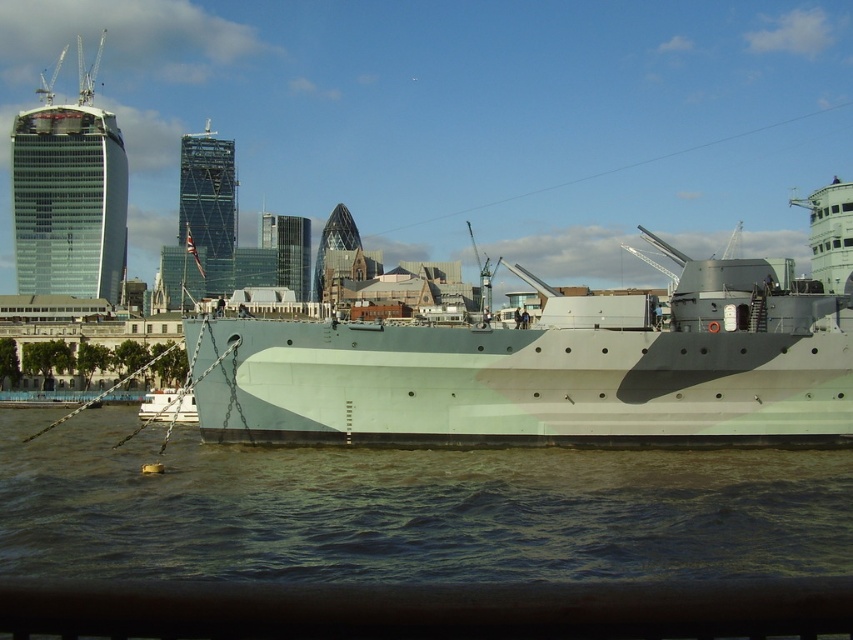
Question: Which point is closer to the camera?

Choices:
 (A) (178, 413)
 (B) (405, 552)

Answer: (B)

Question: Is light gray metallic ship at center below white matte boat at lower left?

Choices:
 (A) no
 (B) yes

Answer: (A)

Question: Can you confirm if greenish water at lower center is positioned to the right of light gray metallic ship at center?

Choices:
 (A) no
 (B) yes

Answer: (A)

Question: Which point is closer to the camera taking this photo?

Choices:
 (A) (669, 387)
 (B) (572, 566)

Answer: (B)

Question: Is greenish water at lower center to the right of light gray metallic ship at center from the viewer's perspective?

Choices:
 (A) no
 (B) yes

Answer: (A)

Question: Which of these objects is positioned closest to the light gray metallic ship at center?

Choices:
 (A) white matte boat at lower left
 (B) greenish water at lower center

Answer: (B)